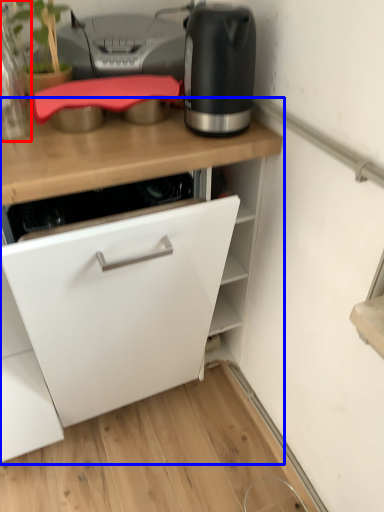
Question: Which object is further to the camera taking this photo, kitchen appliance (highlighted by a red box) or cabinetry (highlighted by a blue box)?

Choices:
 (A) kitchen appliance
 (B) cabinetry

Answer: (A)